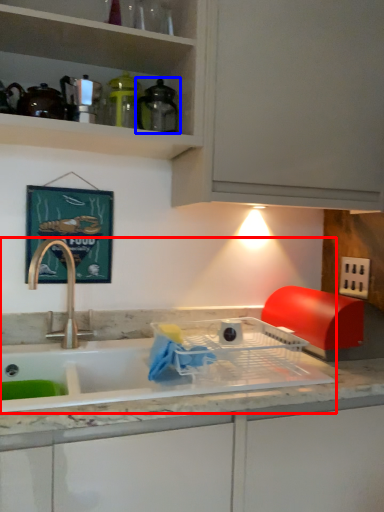
Question: Which point is closer to the camera, sink (highlighted by a red box) or appliance (highlighted by a blue box)?

Choices:
 (A) sink
 (B) appliance

Answer: (A)